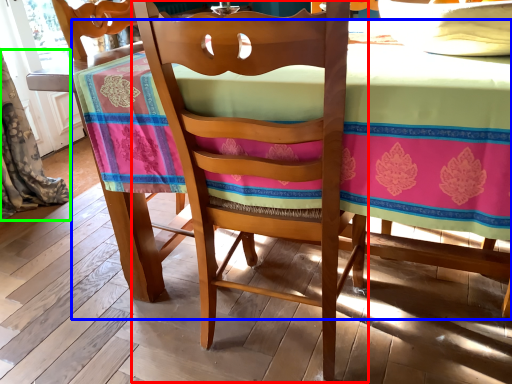
Question: Considering the real-world distances, which object is closest to chair (highlighted by a red box)? table (highlighted by a blue box) or curtain (highlighted by a green box).

Choices:
 (A) table
 (B) curtain

Answer: (A)